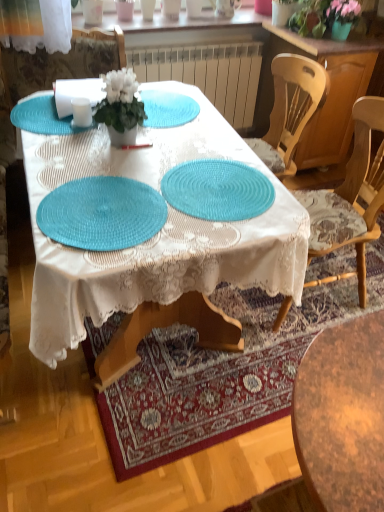
The image size is (384, 512). Identify the location of free space above teal woven placemat at upper left, which ranks as the third glass plate in bottom-to-top order (from a real-world perspective). (42, 113).